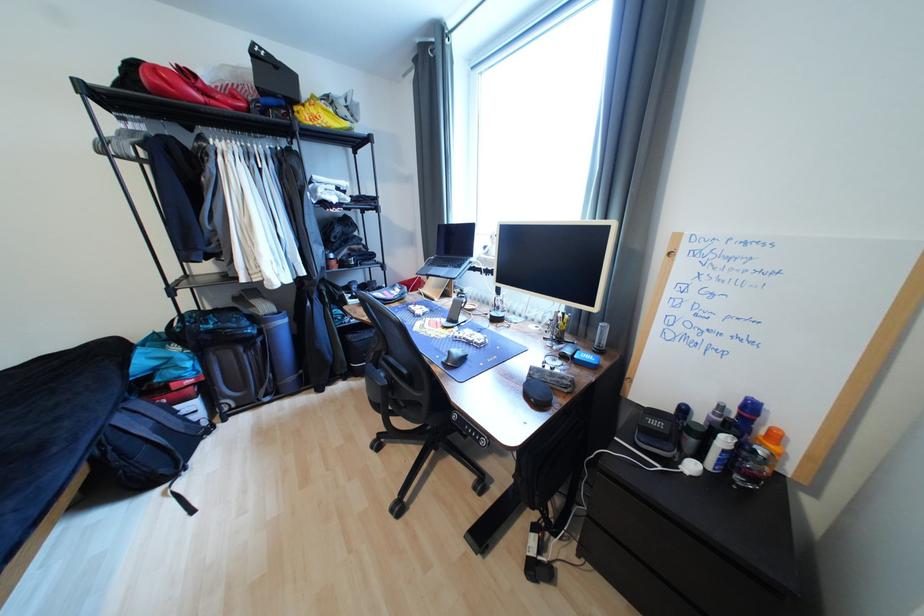
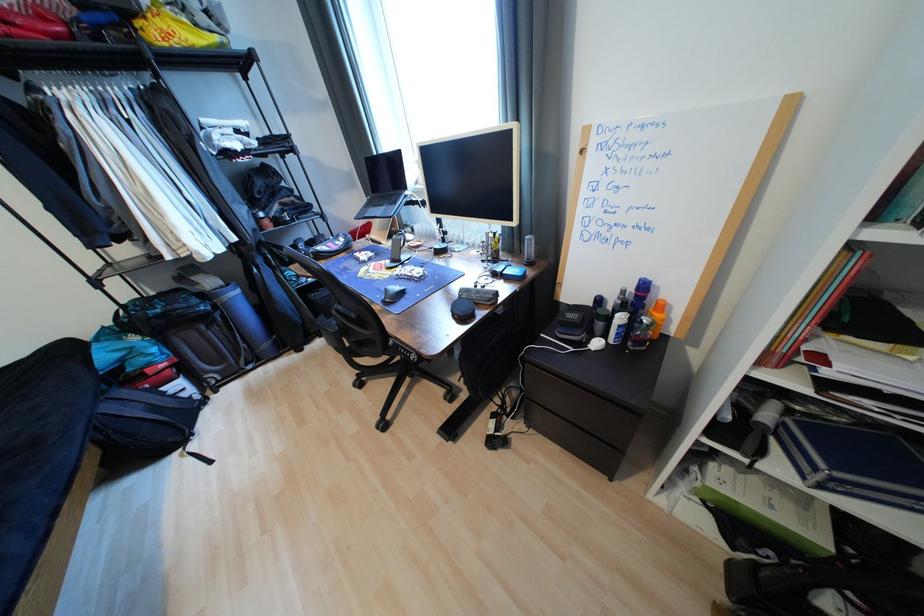
The point at (354, 126) is marked in the first image. Where is the corresponding point in the second image?

(223, 39)